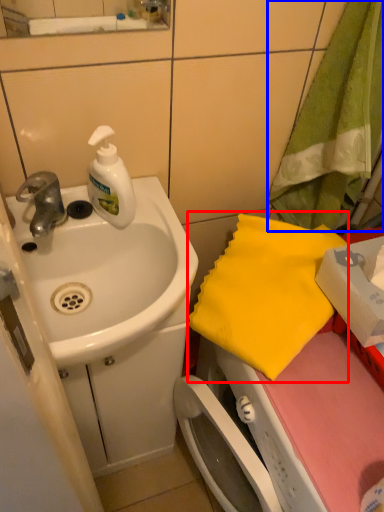
Question: Which point is closer to the camera, beach towel (highlighted by a red box) or beach towel (highlighted by a blue box)?

Choices:
 (A) beach towel
 (B) beach towel

Answer: (B)